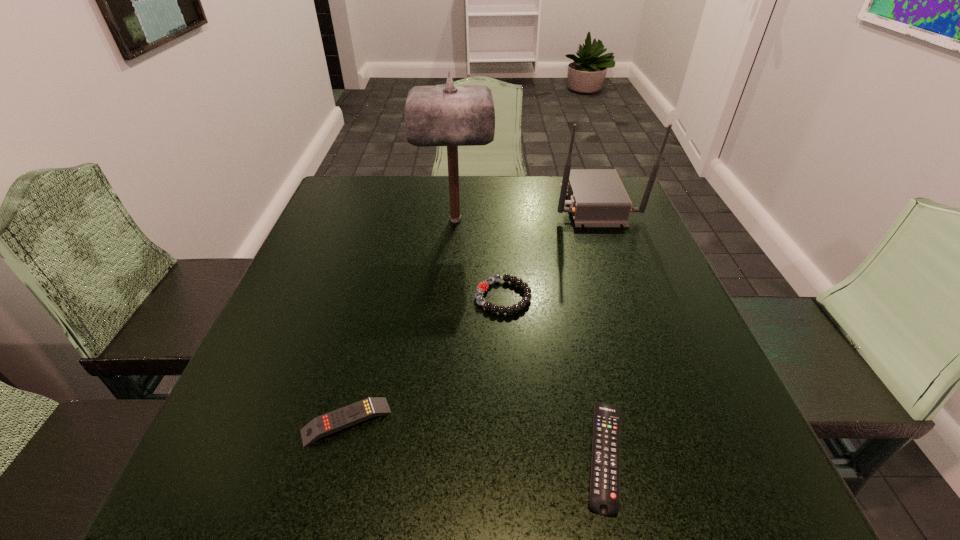
Find the location of a particular element. The height and width of the screenshot is (540, 960). free location at the right edge of the desktop is located at coordinates (681, 387).

Locate an element on the screen. The height and width of the screenshot is (540, 960). free space at the far left corner of the desktop is located at coordinates (375, 191).

Locate an element on the screen. The width and height of the screenshot is (960, 540). blank area at the near left corner is located at coordinates (226, 502).

In the image, there is a desktop. Find the location of `free space at the near right corner`. free space at the near right corner is located at coordinates (742, 481).

At what (x,y) coordinates should I click in order to perform the action: click on vacant point located between the left remote control and the second tallest object. Please return your answer as a coordinate pair (x, y). This screenshot has width=960, height=540. Looking at the image, I should click on (470, 312).

The width and height of the screenshot is (960, 540). In order to click on unoccupied position between the router and the right remote control in this screenshot , I will do `click(599, 329)`.

What are the coordinates of `vacant region between the left remote control and the mallet` in the screenshot? It's located at (400, 320).

Find the location of a particular element. Image resolution: width=960 pixels, height=540 pixels. vacant space in between the right remote control and the mallet is located at coordinates (530, 338).

The height and width of the screenshot is (540, 960). I want to click on free space between the left remote control and the tallest object, so click(400, 320).

Image resolution: width=960 pixels, height=540 pixels. I want to click on free space between the fourth shortest object and the left remote control, so click(x=470, y=312).